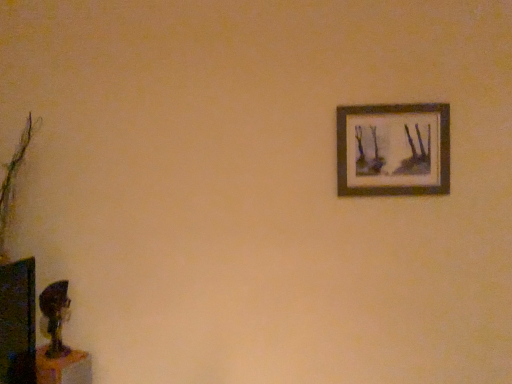
Question: Could you tell me if wooden frame at upper right is turned towards wooden table at lower left?

Choices:
 (A) yes
 (B) no

Answer: (B)

Question: Considering the relative sizes of wooden frame at upper right and wooden table at lower left in the image provided, is wooden frame at upper right thinner than wooden table at lower left?

Choices:
 (A) no
 (B) yes

Answer: (B)

Question: Is wooden frame at upper right positioned with its back to wooden table at lower left?

Choices:
 (A) no
 (B) yes

Answer: (A)

Question: From a real-world perspective, is wooden frame at upper right on top of wooden table at lower left?

Choices:
 (A) yes
 (B) no

Answer: (A)

Question: Can you confirm if wooden frame at upper right is wider than wooden table at lower left?

Choices:
 (A) yes
 (B) no

Answer: (B)

Question: From the image's perspective, is wooden frame at upper right on wooden table at lower left?

Choices:
 (A) yes
 (B) no

Answer: (A)

Question: Considering the relative sizes of wooden table at lower left and wooden frame at upper right in the image provided, is wooden table at lower left smaller than wooden frame at upper right?

Choices:
 (A) no
 (B) yes

Answer: (B)

Question: From a real-world perspective, is wooden table at lower left located beneath wooden frame at upper right?

Choices:
 (A) no
 (B) yes

Answer: (B)

Question: Is wooden table at lower left beside wooden frame at upper right?

Choices:
 (A) no
 (B) yes

Answer: (A)

Question: Is wooden table at lower left located outside wooden frame at upper right?

Choices:
 (A) no
 (B) yes

Answer: (B)

Question: Is wooden table at lower left taller than wooden frame at upper right?

Choices:
 (A) no
 (B) yes

Answer: (A)

Question: Considering the relative sizes of wooden table at lower left and wooden frame at upper right in the image provided, is wooden table at lower left bigger than wooden frame at upper right?

Choices:
 (A) no
 (B) yes

Answer: (A)

Question: Is wooden table at lower left to the left or to the right of wooden frame at upper right in the image?

Choices:
 (A) right
 (B) left

Answer: (B)